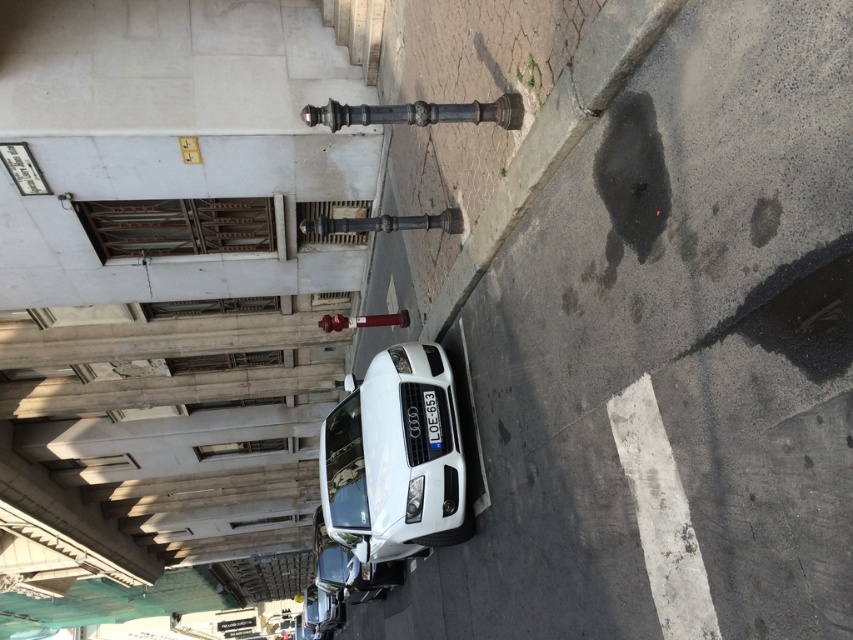
Question: Which point appears closest to the camera in this image?

Choices:
 (A) (434, 440)
 (B) (392, 376)

Answer: (A)

Question: Which point is farther to the camera?

Choices:
 (A) white glossy car at center
 (B) black plastic license plate at center

Answer: (B)

Question: Is the position of white glossy car at center less distant than that of black plastic license plate at center?

Choices:
 (A) yes
 (B) no

Answer: (A)

Question: Does white glossy car at center appear over black plastic license plate at center?

Choices:
 (A) yes
 (B) no

Answer: (B)

Question: Where is white glossy car at center located in relation to black plastic license plate at center in the image?

Choices:
 (A) right
 (B) left

Answer: (B)